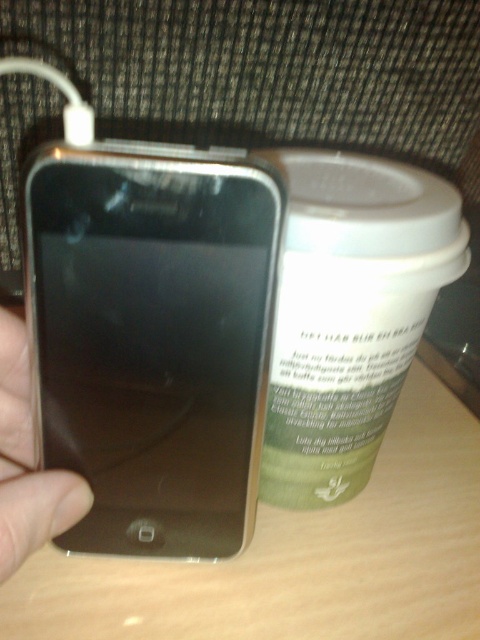
Between satin gold ipod at left and metallic silver phone at left, which one has more height?

Standing taller between the two is satin gold ipod at left.

Is satin gold ipod at left thinner than metallic silver phone at left?

No, satin gold ipod at left is not thinner than metallic silver phone at left.

Between point (196, 266) and point (22, 545), which one is positioned behind?

Point (196, 266)

What are the coordinates of `satin gold ipod at left` in the screenshot? It's located at (153, 339).